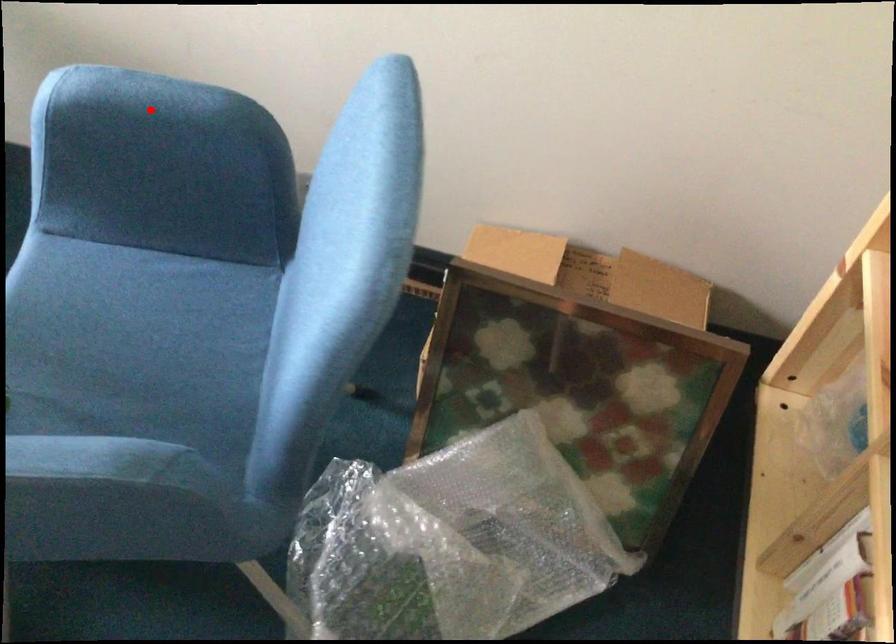
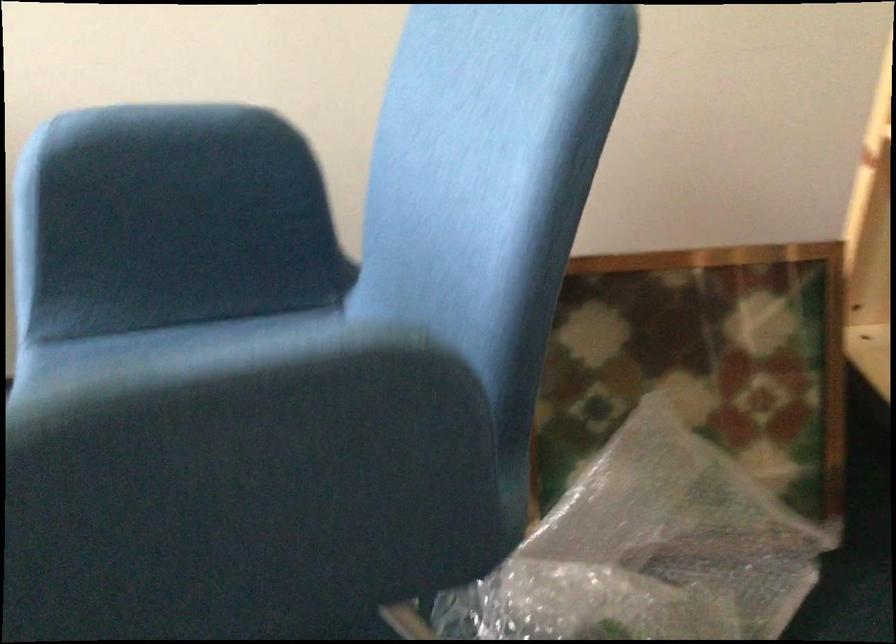
Question: I am providing you with two images of the same scene from different viewpoints. Given a red point in image1, look at the same physical point in image2. Is it:

Choices:
 (A) Closer to the viewpoint
 (B) Farther from the viewpoint

Answer: (A)